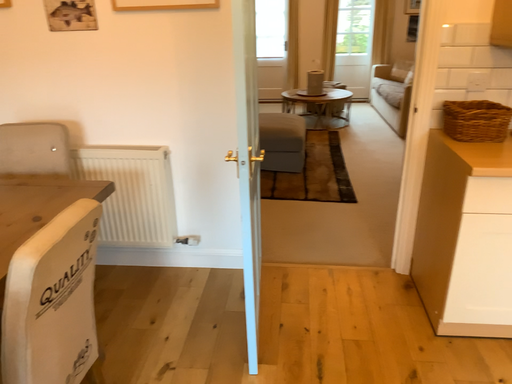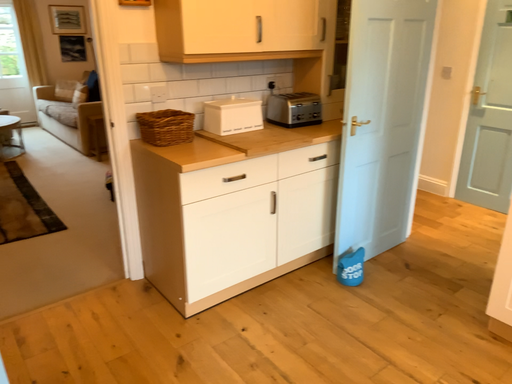
Question: How did the camera likely rotate when shooting the video?

Choices:
 (A) rotated right
 (B) rotated left

Answer: (A)